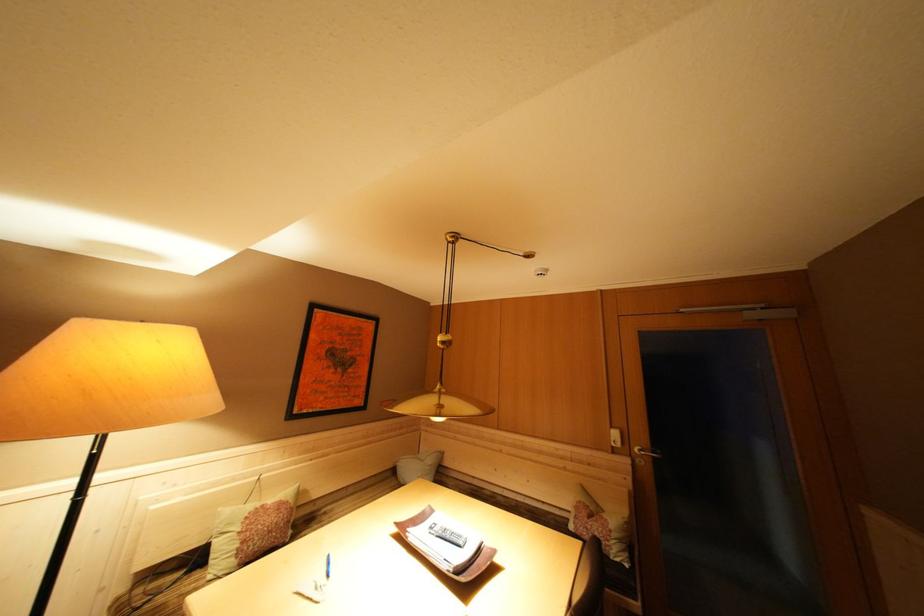
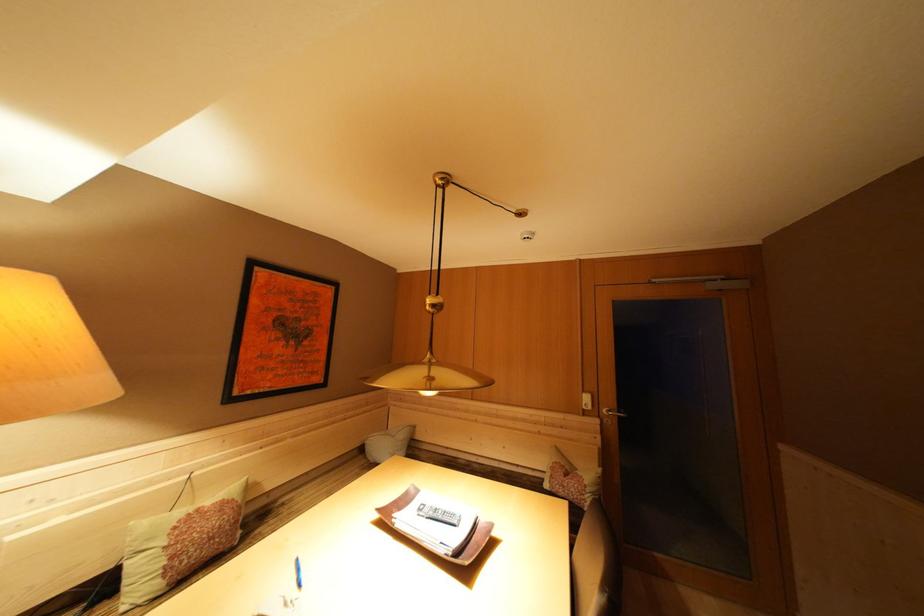
Question: The camera is either moving clockwise (left) or counter-clockwise (right) around the object. The first image is from the beginning of the video and the second image is from the end. Is the camera moving left or right when shooting the video?

Choices:
 (A) Left
 (B) Right

Answer: (A)